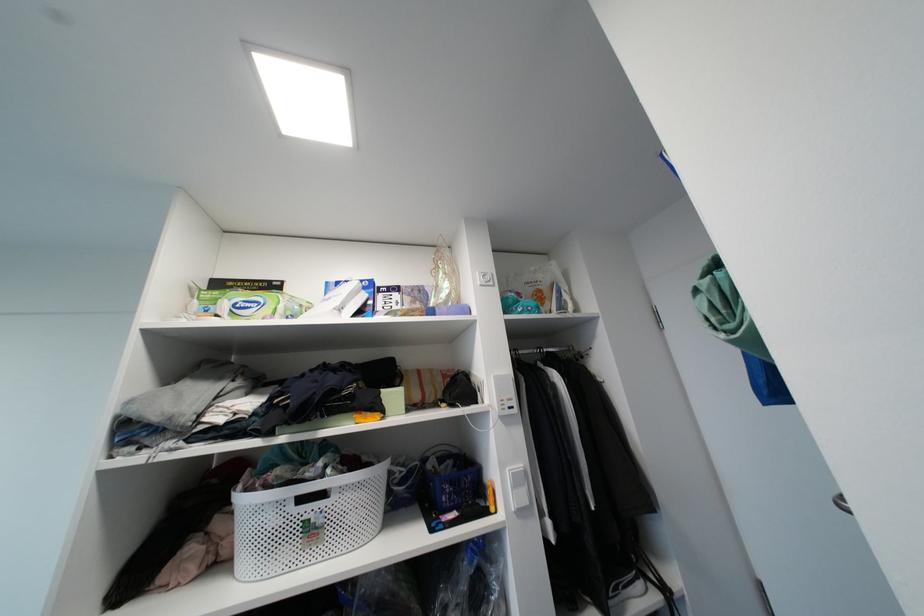
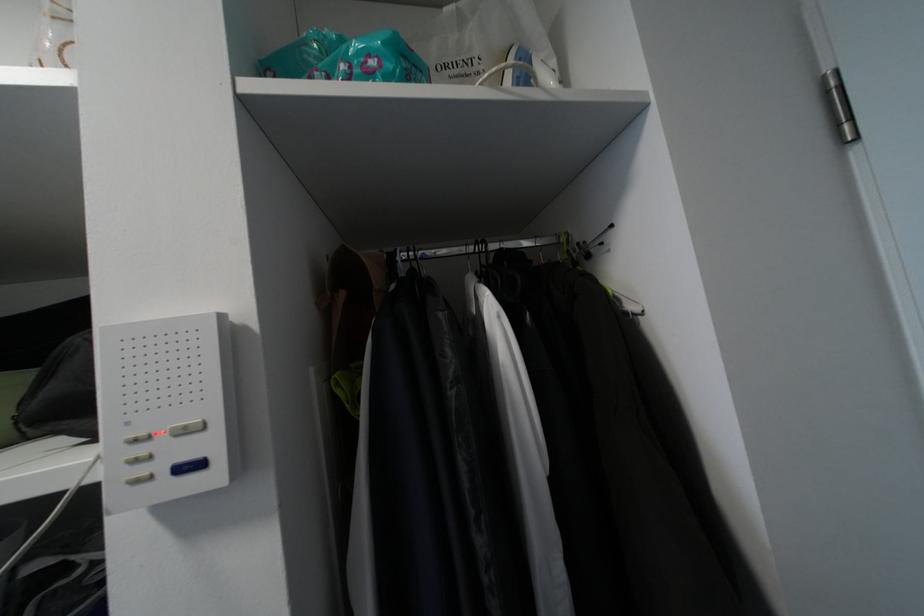
In the second image, find the point that corresponds to point (584, 353) in the first image.

(586, 245)